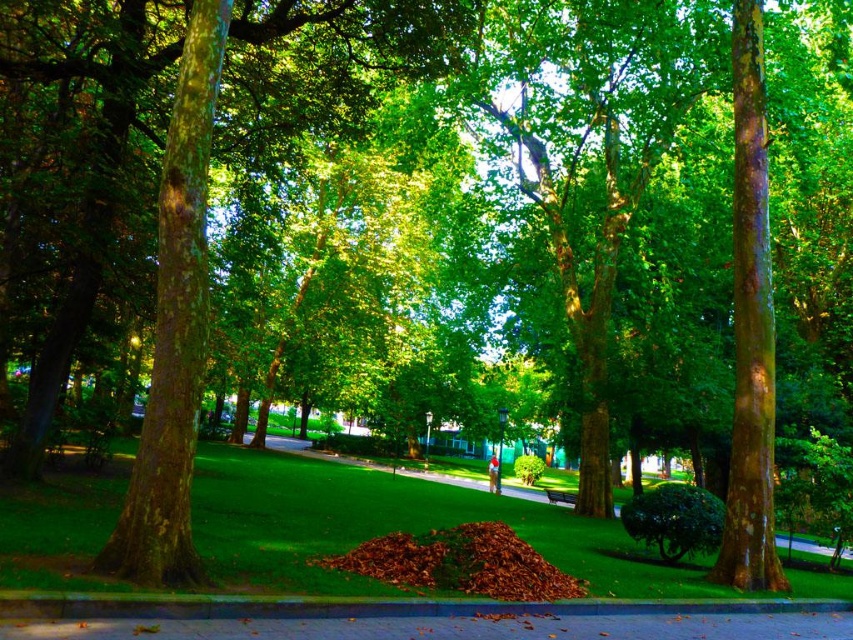
You are a gardener who needs to mow the lawn. You see the green grass at center and the green wooden bench at center. Which one is taller?

The green grass at center is much taller than the green wooden bench at center.